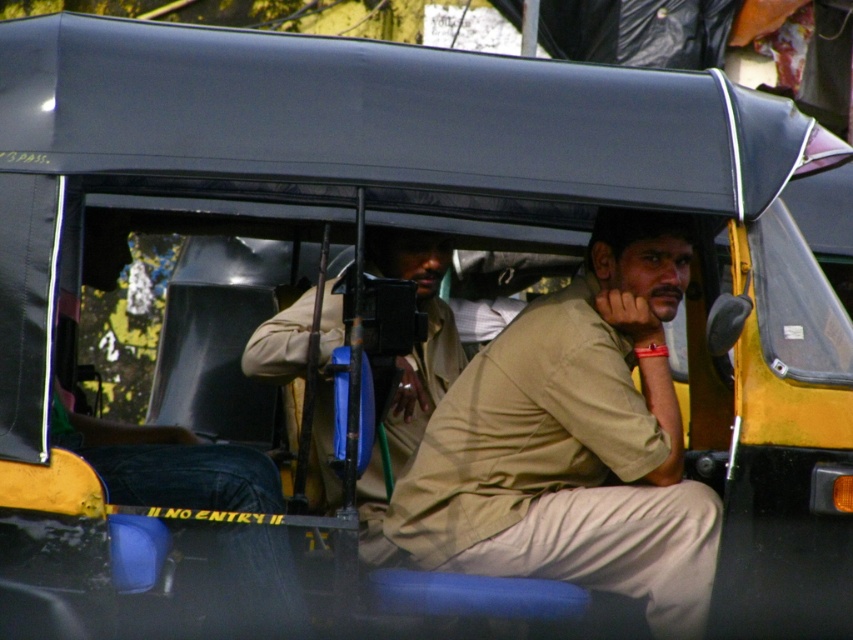
You are a passenger in the tuk tuk and you see the beige cotton shirt at center and the khaki uniform at center. Which one is taller?

The beige cotton shirt at center is much taller than the khaki uniform at center.

Based on the photo, you are a passenger in the tuk tuk and you want to hand a document to the driver. Which item, the beige cotton shirt at center or the khaki uniform at center, is closer to your hand when reaching forward?

→ The beige cotton shirt at center is positioned under the khaki uniform at center, so when reaching forward, the beige cotton shirt at center would be closer to your hand.